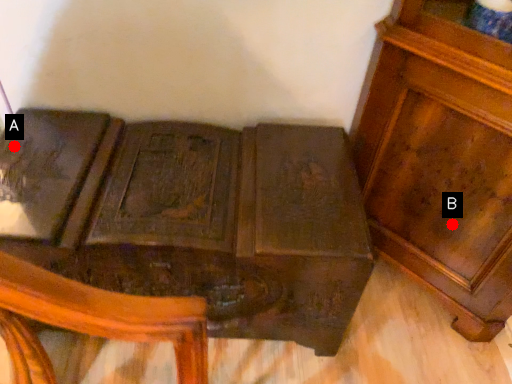
Question: Two points are circled on the image, labeled by A and B beside each circle. Which point is further to the camera?

Choices:
 (A) A is further
 (B) B is further

Answer: (B)